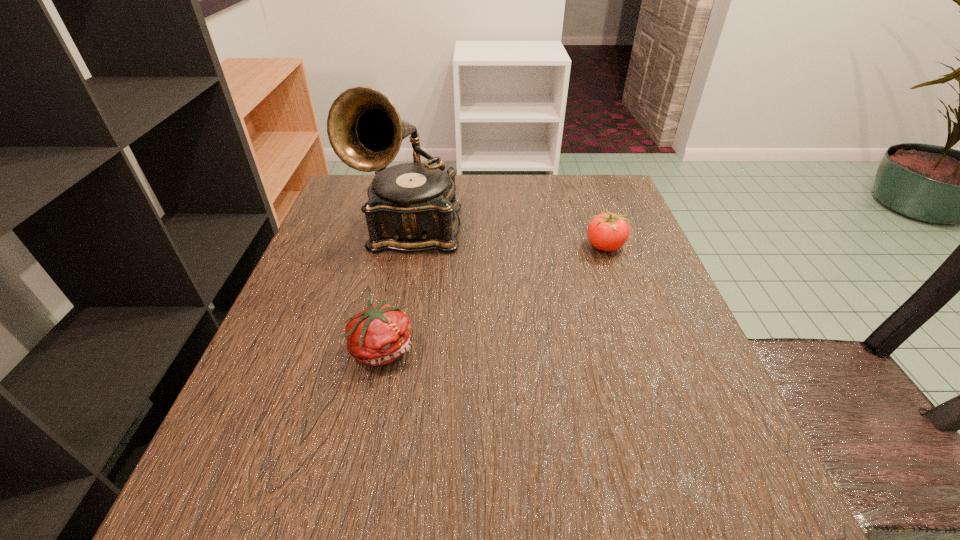
Where is `tomato located at the left edge`? tomato located at the left edge is located at coordinates click(378, 335).

Locate an element on the screen. object at the right edge is located at coordinates (608, 231).

This screenshot has width=960, height=540. Identify the location of object that is at the far left corner. (412, 207).

You are a GUI agent. You are given a task and a screenshot of the screen. Output one action in this format:
    pyautogui.click(x=<x>, y=<y>)
    Task: Click on the blank space at the far edge
    The height and width of the screenshot is (540, 960).
    Given the screenshot: What is the action you would take?
    pyautogui.click(x=544, y=209)

Locate an element on the screen. This screenshot has width=960, height=540. vacant region at the near edge of the desktop is located at coordinates (366, 501).

The image size is (960, 540). Find the location of `free region at the left edge`. free region at the left edge is located at coordinates tap(348, 280).

Find the location of a particular element. The width and height of the screenshot is (960, 540). free spot at the right edge of the desktop is located at coordinates (723, 403).

Locate an element on the screen. This screenshot has height=540, width=960. free space at the far right corner of the desktop is located at coordinates tap(559, 187).

Locate an element on the screen. Image resolution: width=960 pixels, height=540 pixels. vacant space at the near right corner is located at coordinates (706, 484).

Image resolution: width=960 pixels, height=540 pixels. Find the location of `empty location between the nearer tomato and the farther tomato`. empty location between the nearer tomato and the farther tomato is located at coordinates pyautogui.click(x=493, y=297).